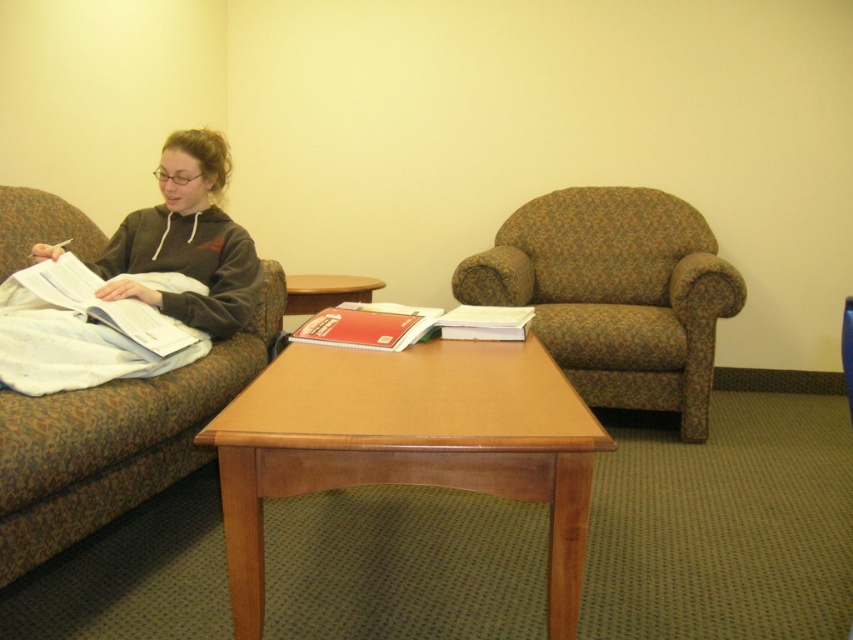
Is light brown wood table at center wider than red matte book at center?

Yes, light brown wood table at center is wider than red matte book at center.

Is light brown wood table at center smaller than red matte book at center?

Actually, light brown wood table at center might be larger than red matte book at center.

This screenshot has height=640, width=853. Find the location of `light brown wood table at center`. light brown wood table at center is located at coordinates [x=407, y=445].

Is point (564, 301) farther from camera compared to point (241, 259)?

Yes, point (564, 301) is behind point (241, 259).

You are a GUI agent. You are given a task and a screenshot of the screen. Output one action in this format:
    pyautogui.click(x=<x>, y=<y>)
    Task: Click on the brown floral fabric armchair at center-right
    The height and width of the screenshot is (640, 853).
    Given the screenshot: What is the action you would take?
    click(x=614, y=294)

Does dark gray hoodie at upper left appear on the left side of red matte book at center?

Yes, dark gray hoodie at upper left is to the left of red matte book at center.

Is dark gray hoodie at upper left behind red matte book at center?

Yes, it is.

The image size is (853, 640). Identify the location of dark gray hoodie at upper left. (187, 241).

This screenshot has width=853, height=640. What are the coordinates of `dark gray hoodie at upper left` in the screenshot? It's located at (187, 241).